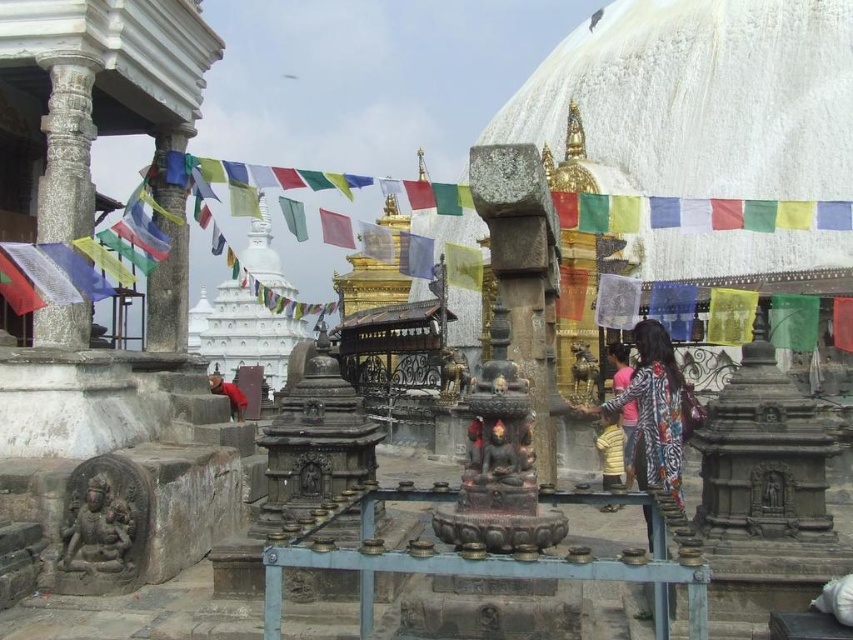
Between carved stone pillar at left and pink fabric at center, which one appears on the right side from the viewer's perspective?

pink fabric at center

Which is behind, point (65, 100) or point (628, 381)?

The point (628, 381) is behind.

Where is `carved stone pillar at left`? carved stone pillar at left is located at coordinates (67, 150).

Does dark brown stone statue at lower left have a lesser height compared to red fabric person at lower left?

Yes, dark brown stone statue at lower left is shorter than red fabric person at lower left.

In order to click on dark brown stone statue at lower left in this screenshot , I will do `click(97, 529)`.

Does point (97, 557) come closer to viewer compared to point (230, 381)?

That is True.

This screenshot has height=640, width=853. In order to click on dark brown stone statue at lower left in this screenshot , I will do `click(97, 529)`.

Looking at this image, does matte black statue at center come in front of red fabric person at lower left?

Yes, matte black statue at center is closer to the viewer.

Is matte black statue at center below red fabric person at lower left?

Actually, matte black statue at center is above red fabric person at lower left.

Does point (497, 456) come closer to viewer compared to point (239, 392)?

Yes, point (497, 456) is closer to viewer.

Where is `matte black statue at center`? matte black statue at center is located at coordinates (500, 456).